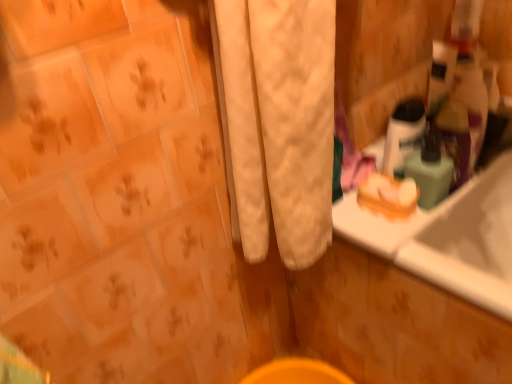
Question: Can you confirm if orange matte soap at right is smaller than green matte bottle at upper right, marked as the first mouthwash in a right-to-left arrangement?

Choices:
 (A) no
 (B) yes

Answer: (B)

Question: Does orange matte soap at right lie behind green matte bottle at upper right, marked as the first mouthwash in a right-to-left arrangement?

Choices:
 (A) no
 (B) yes

Answer: (B)

Question: Does orange matte soap at right have a lesser height compared to green matte bottle at upper right, the 2th mouthwash in the left-to-right sequence?

Choices:
 (A) no
 (B) yes

Answer: (B)

Question: Is orange matte soap at right facing away from green matte bottle at upper right, the 2th mouthwash in the left-to-right sequence?

Choices:
 (A) yes
 (B) no

Answer: (B)

Question: Considering the relative sizes of orange matte soap at right and green matte bottle at upper right, the 2th mouthwash in the left-to-right sequence, in the image provided, is orange matte soap at right taller than green matte bottle at upper right, the 2th mouthwash in the left-to-right sequence,?

Choices:
 (A) yes
 (B) no

Answer: (B)

Question: From a real-world perspective, is translucent plastic mouthwash at upper right, the 1th mouthwash from the left, positioned above or below green matte bottle at upper right, the 2th mouthwash in the left-to-right sequence?

Choices:
 (A) below
 (B) above

Answer: (B)

Question: In terms of size, does translucent plastic mouthwash at upper right, arranged as the second mouthwash when viewed from the right, appear bigger or smaller than green matte bottle at upper right, marked as the first mouthwash in a right-to-left arrangement?

Choices:
 (A) small
 (B) big

Answer: (B)

Question: Considering their positions, is translucent plastic mouthwash at upper right, arranged as the second mouthwash when viewed from the right, located in front of or behind green matte bottle at upper right, marked as the first mouthwash in a right-to-left arrangement?

Choices:
 (A) behind
 (B) front

Answer: (A)

Question: Is translucent plastic mouthwash at upper right, the 1th mouthwash from the left, wider or thinner than green matte bottle at upper right, marked as the first mouthwash in a right-to-left arrangement?

Choices:
 (A) thin
 (B) wide

Answer: (A)

Question: Considering the positions of orange matte soap at right and translucent plastic mouthwash at upper right, the 1th mouthwash from the left, in the image, is orange matte soap at right wider or thinner than translucent plastic mouthwash at upper right, the 1th mouthwash from the left,?

Choices:
 (A) wide
 (B) thin

Answer: (A)

Question: In the image, is orange matte soap at right positioned in front of or behind translucent plastic mouthwash at upper right, the 1th mouthwash from the left?

Choices:
 (A) behind
 (B) front

Answer: (A)

Question: From the image's perspective, is orange matte soap at right located above or below translucent plastic mouthwash at upper right, the 1th mouthwash from the left?

Choices:
 (A) below
 (B) above

Answer: (A)

Question: From their relative heights in the image, would you say orange matte soap at right is taller or shorter than translucent plastic mouthwash at upper right, arranged as the second mouthwash when viewed from the right?

Choices:
 (A) short
 (B) tall

Answer: (A)

Question: From the image's perspective, is orange matte soap at right above or below green matte bottle at upper right, marked as the first mouthwash in a right-to-left arrangement?

Choices:
 (A) above
 (B) below

Answer: (B)

Question: From a real-world perspective, is orange matte soap at right positioned above or below green matte bottle at upper right, marked as the first mouthwash in a right-to-left arrangement?

Choices:
 (A) below
 (B) above

Answer: (A)